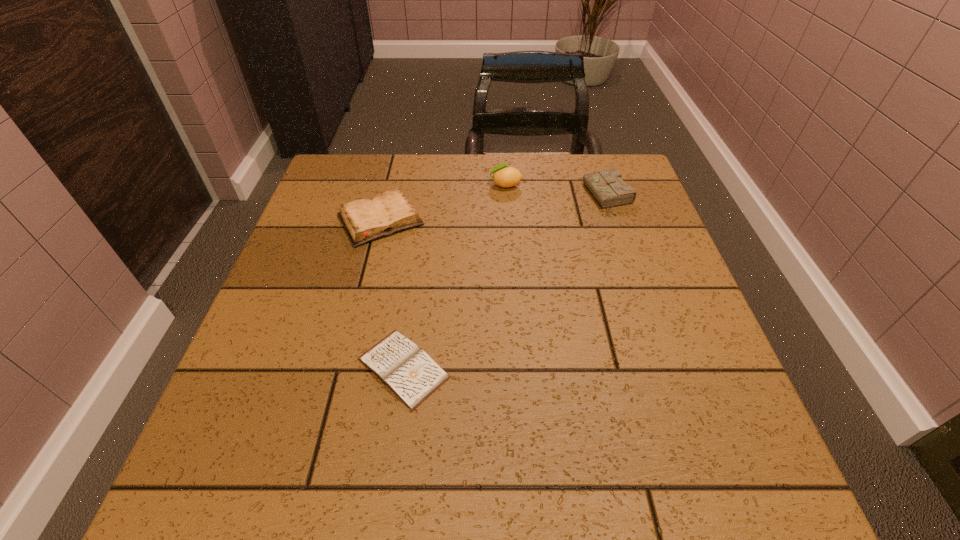
This screenshot has width=960, height=540. I want to click on free spot between the second object from right to left and the rightmost object, so click(557, 191).

I want to click on vacant space that is in between the lemon and the rightmost object, so click(x=557, y=191).

I want to click on vacant area between the third tallest object and the rightmost diary, so click(x=494, y=208).

You are a GUI agent. You are given a task and a screenshot of the screen. Output one action in this format:
    pyautogui.click(x=<x>, y=<y>)
    Task: Click on the free space between the third tallest object and the rightmost diary
    The height and width of the screenshot is (540, 960).
    Given the screenshot: What is the action you would take?
    pyautogui.click(x=494, y=208)

The height and width of the screenshot is (540, 960). I want to click on object that is the closest to the nearest object, so click(365, 220).

Locate an element on the screen. object that ranks as the second closest to the nearest diary is located at coordinates (504, 176).

Locate an element on the screen. the second closest diary to the second shortest diary is located at coordinates (607, 187).

Identify the location of diary that stands as the closest to the rightmost object. Image resolution: width=960 pixels, height=540 pixels. (365, 220).

This screenshot has height=540, width=960. I want to click on free space that satisfies the following two spatial constraints: 1. on the front side of the second tallest diary; 2. on the left side of the nearest object, so click(x=344, y=368).

In order to click on free space that satisfies the following two spatial constraints: 1. on the back side of the rightmost diary; 2. with leaves positioned above the third object from left to right in this screenshot , I will do `click(604, 185)`.